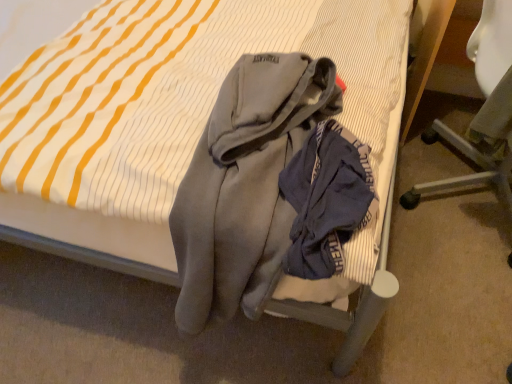
This screenshot has width=512, height=384. Describe the element at coordinates (245, 185) in the screenshot. I see `gray fleece hoodie at center` at that location.

This screenshot has width=512, height=384. I want to click on gray fleece hoodie at center, so click(245, 185).

What is the approximate height of white plastic chair at upper right?

The height of white plastic chair at upper right is 22.53 inches.

Where is `white plastic chair at upper right`? This screenshot has height=384, width=512. white plastic chair at upper right is located at coordinates (484, 109).

Image resolution: width=512 pixels, height=384 pixels. What do you see at coordinates (484, 109) in the screenshot?
I see `white plastic chair at upper right` at bounding box center [484, 109].

Where is `gray fleece hoodie at center`? The height and width of the screenshot is (384, 512). gray fleece hoodie at center is located at coordinates (245, 185).

Does white plastic chair at upper right appear on the left side of gray fleece hoodie at center?

In fact, white plastic chair at upper right is to the right of gray fleece hoodie at center.

Considering their positions, is white plastic chair at upper right located in front of or behind gray fleece hoodie at center?

In the image, white plastic chair at upper right appears behind gray fleece hoodie at center.

Is point (430, 135) farther from camera compared to point (267, 161)?

Yes, it is behind point (267, 161).

From the image's perspective, does white plastic chair at upper right appear higher than gray fleece hoodie at center?

Indeed, from the image's perspective, white plastic chair at upper right is shown above gray fleece hoodie at center.

From a real-world perspective, is white plastic chair at upper right physically located above or below gray fleece hoodie at center?

From a real-world perspective, white plastic chair at upper right is physically below gray fleece hoodie at center.

Can you confirm if white plastic chair at upper right is wider than gray fleece hoodie at center?

No, white plastic chair at upper right is not wider than gray fleece hoodie at center.

Which of these two, white plastic chair at upper right or gray fleece hoodie at center, stands taller?

white plastic chair at upper right is taller.

Considering the sizes of objects white plastic chair at upper right and gray fleece hoodie at center in the image provided, who is smaller, white plastic chair at upper right or gray fleece hoodie at center?

gray fleece hoodie at center is smaller.

Which is correct: white plastic chair at upper right is inside gray fleece hoodie at center, or outside of it?

white plastic chair at upper right exists outside the volume of gray fleece hoodie at center.

Is white plastic chair at upper right beside gray fleece hoodie at center?

No, white plastic chair at upper right is not touching gray fleece hoodie at center.

Is white plastic chair at upper right oriented away from gray fleece hoodie at center?

No, white plastic chair at upper right's orientation is not away from gray fleece hoodie at center.

What's the angular difference between white plastic chair at upper right and gray fleece hoodie at center's facing directions?

The angle between the facing direction of white plastic chair at upper right and the facing direction of gray fleece hoodie at center is 0.813 degrees.

Locate an element on the screen. This screenshot has width=512, height=384. chair above the gray fleece hoodie at center (from the image's perspective) is located at coordinates (484, 109).

Is gray fleece hoodie at center at the right side of white plastic chair at upper right?

No.

Does gray fleece hoodie at center lie behind white plastic chair at upper right?

No, gray fleece hoodie at center is in front of white plastic chair at upper right.

Is point (338, 101) positioned after point (497, 164)?

No, (338, 101) is closer to viewer.

From the image's perspective, relative to white plastic chair at upper right, is gray fleece hoodie at center above or below?

gray fleece hoodie at center is below white plastic chair at upper right.

From a real-world perspective, is gray fleece hoodie at center physically located above or below white plastic chair at upper right?

Clearly, from a real-world perspective, gray fleece hoodie at center is above white plastic chair at upper right.

Can you confirm if gray fleece hoodie at center is thinner than white plastic chair at upper right?

In fact, gray fleece hoodie at center might be wider than white plastic chair at upper right.

Considering the relative sizes of gray fleece hoodie at center and white plastic chair at upper right in the image provided, is gray fleece hoodie at center taller than white plastic chair at upper right?

In fact, gray fleece hoodie at center may be shorter than white plastic chair at upper right.

Between gray fleece hoodie at center and white plastic chair at upper right, which one has smaller size?

Smaller between the two is gray fleece hoodie at center.

Is gray fleece hoodie at center not inside white plastic chair at upper right?

Yes, gray fleece hoodie at center is outside of white plastic chair at upper right.

Are gray fleece hoodie at center and white plastic chair at upper right located far from each other?

No.

Is gray fleece hoodie at center oriented towards white plastic chair at upper right?

No, gray fleece hoodie at center is not oriented towards white plastic chair at upper right.

The height and width of the screenshot is (384, 512). In order to click on chair below the gray fleece hoodie at center (from a real-world perspective) in this screenshot , I will do click(484, 109).

This screenshot has height=384, width=512. In order to click on chair behind the gray fleece hoodie at center in this screenshot , I will do `click(484, 109)`.

This screenshot has width=512, height=384. I want to click on chair on the right of gray fleece hoodie at center, so click(x=484, y=109).